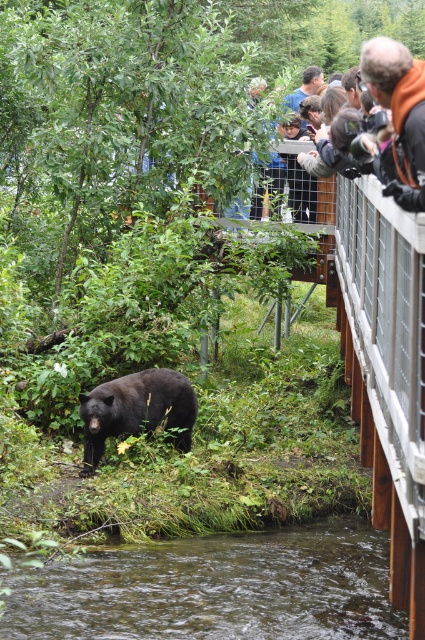
Question: Observing the image, what is the correct spatial positioning of clear water at lower center in reference to orange jacket at upper right?

Choices:
 (A) left
 (B) right

Answer: (A)

Question: Observing the image, what is the correct spatial positioning of clear water at lower center in reference to black furry bear at lower left?

Choices:
 (A) right
 (B) left

Answer: (A)

Question: Which point is closer to the camera taking this photo?

Choices:
 (A) (13, 579)
 (B) (170, 412)
 (C) (418, 211)

Answer: (C)

Question: Does black furry bear at lower left have a greater width compared to orange jacket at upper right?

Choices:
 (A) yes
 (B) no

Answer: (A)

Question: Which of the following is the closest to the observer?

Choices:
 (A) (402, 148)
 (B) (258, 541)

Answer: (A)

Question: Which point is closer to the camera?

Choices:
 (A) clear water at lower center
 (B) black furry bear at lower left
 (C) orange jacket at upper right

Answer: (C)